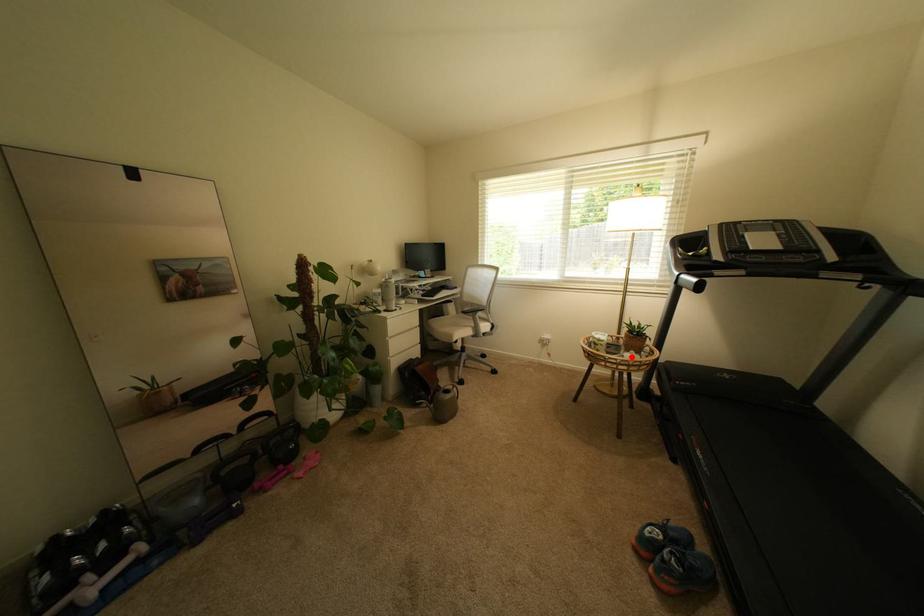
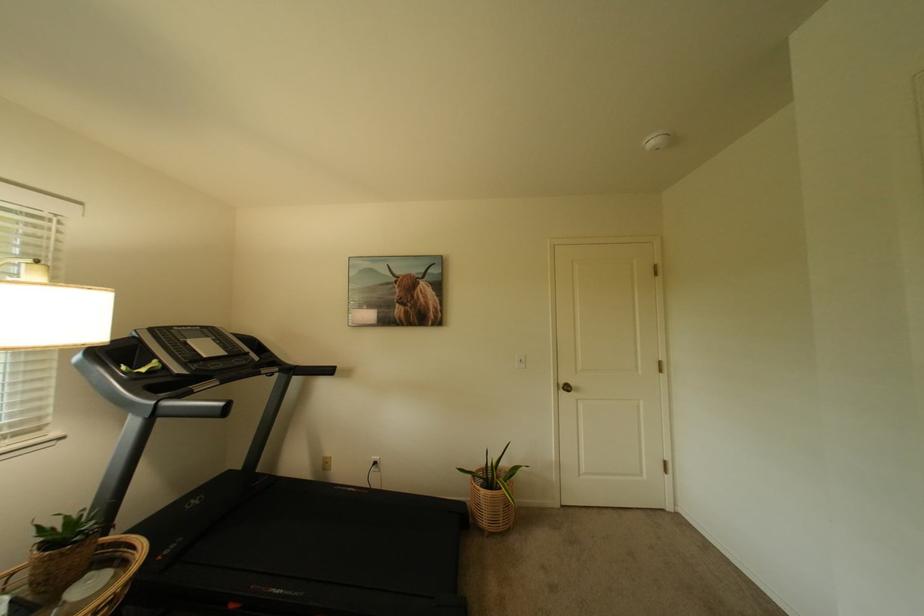
Find the pixel in the second image that matches the highlighted location in the first image.

(73, 605)